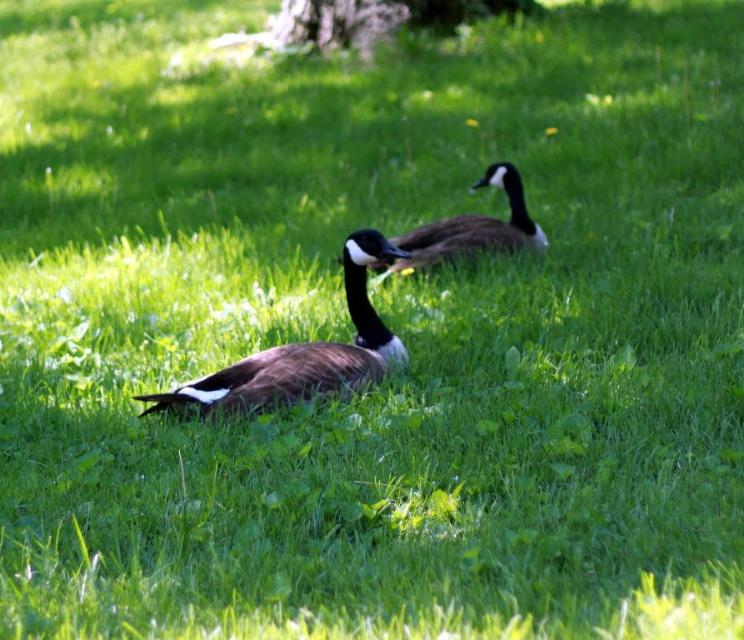
Question: Which object is closer to the camera taking this photo?

Choices:
 (A) smooth bark tree at upper center
 (B) brown matte goose at center

Answer: (B)

Question: From the image, what is the correct spatial relationship of brown matte goose at center in relation to smooth bark tree at upper center?

Choices:
 (A) above
 (B) below

Answer: (B)

Question: Does smooth bark tree at upper center appear under brown speckled goose at center?

Choices:
 (A) yes
 (B) no

Answer: (B)

Question: Which of these objects is positioned closest to the brown speckled goose at center?

Choices:
 (A) smooth bark tree at upper center
 (B) brown matte goose at center

Answer: (B)

Question: Which point is farther to the camera?

Choices:
 (A) brown matte goose at center
 (B) brown speckled goose at center
 (C) smooth bark tree at upper center

Answer: (C)

Question: Is brown matte goose at center thinner than brown speckled goose at center?

Choices:
 (A) no
 (B) yes

Answer: (A)